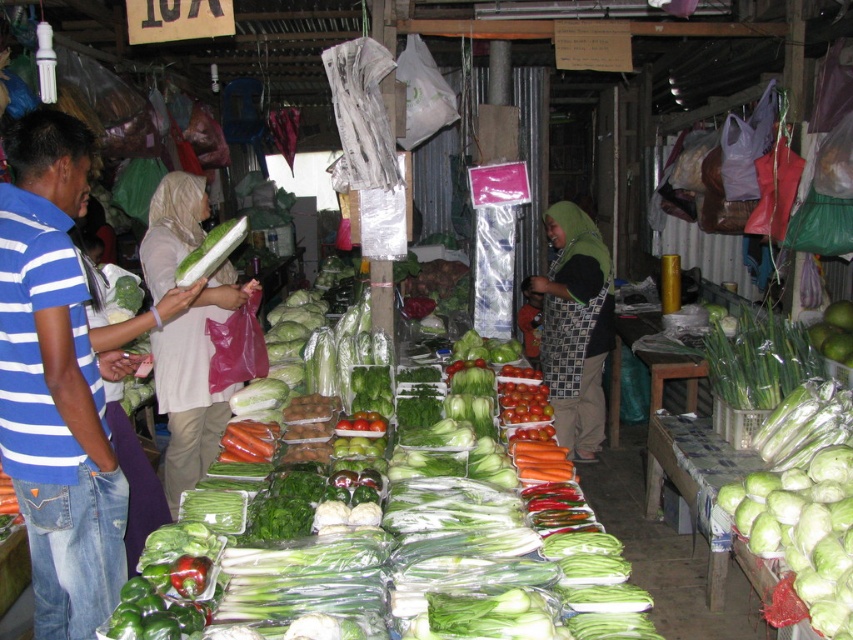
Question: Observing the image, what is the correct spatial positioning of green fabric headscarf at center in reference to ripe red tomatoes at center?

Choices:
 (A) left
 (B) right

Answer: (B)

Question: Which point appears farthest from the camera in this image?

Choices:
 (A) (91, 381)
 (B) (526, 307)

Answer: (B)

Question: Which object is positioned closest to the ripe red tomatoes at center?

Choices:
 (A) blue striped shirt at left
 (B) light beige fabric at center
 (C) green fabric headscarf at center

Answer: (C)

Question: Is blue striped shirt at left thinner than green matte apple at center-right?

Choices:
 (A) no
 (B) yes

Answer: (A)

Question: Among these objects, which one is nearest to the camera?

Choices:
 (A) light beige fabric at center
 (B) ripe red tomatoes at center

Answer: (A)

Question: Does blue striped shirt at left lie in front of green matte apple at center-right?

Choices:
 (A) no
 (B) yes

Answer: (B)